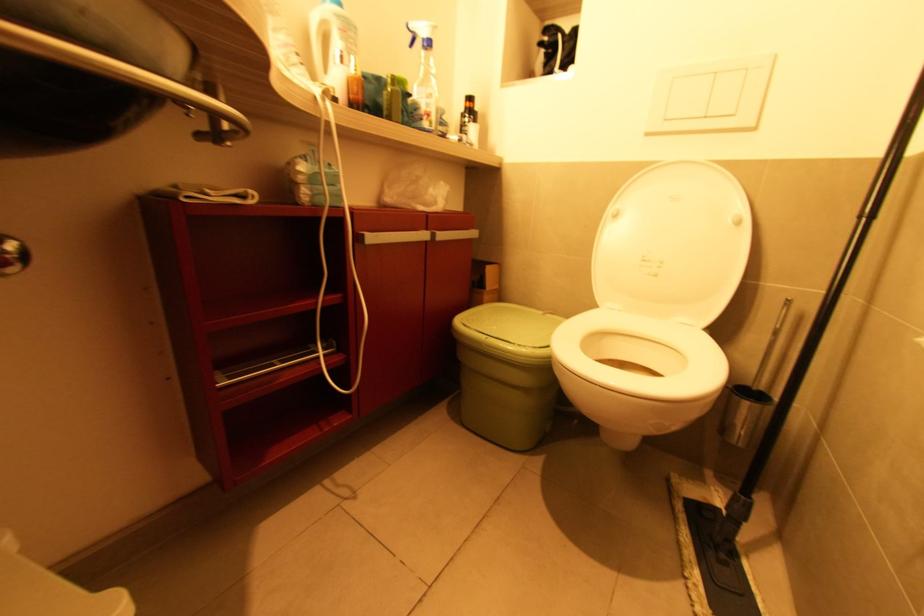
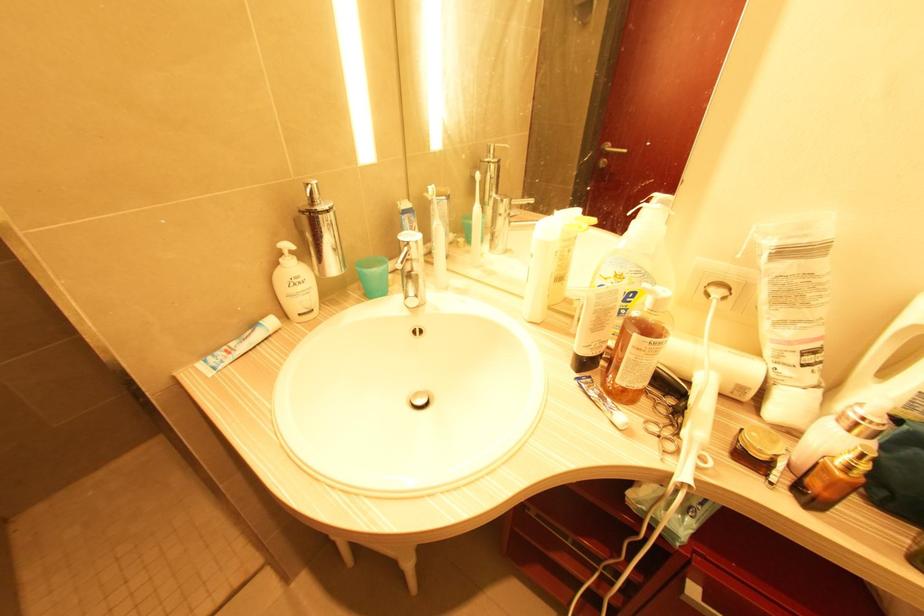
Where in the second image is the point corresponding to [359,73] from the first image?

(850, 468)